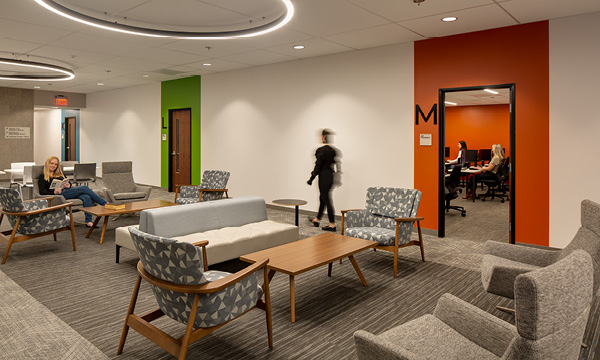
Identify the location of orange around door on the right. The image size is (600, 360). (507, 52).